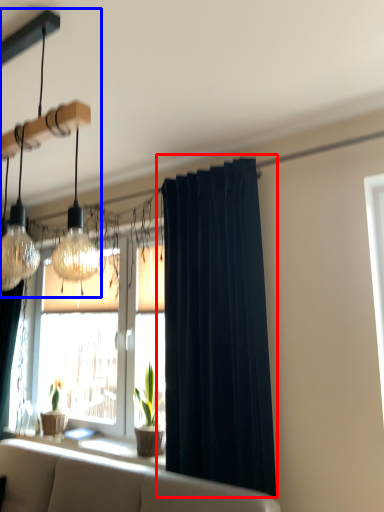
Question: Which object appears farthest to the camera in this image, curtain (highlighted by a red box) or lamp (highlighted by a blue box)?

Choices:
 (A) curtain
 (B) lamp

Answer: (A)